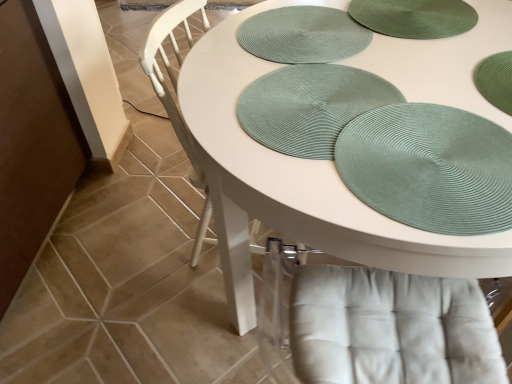
This screenshot has height=384, width=512. I want to click on free spot to the left of green textured placemat at upper right, so click(x=275, y=145).